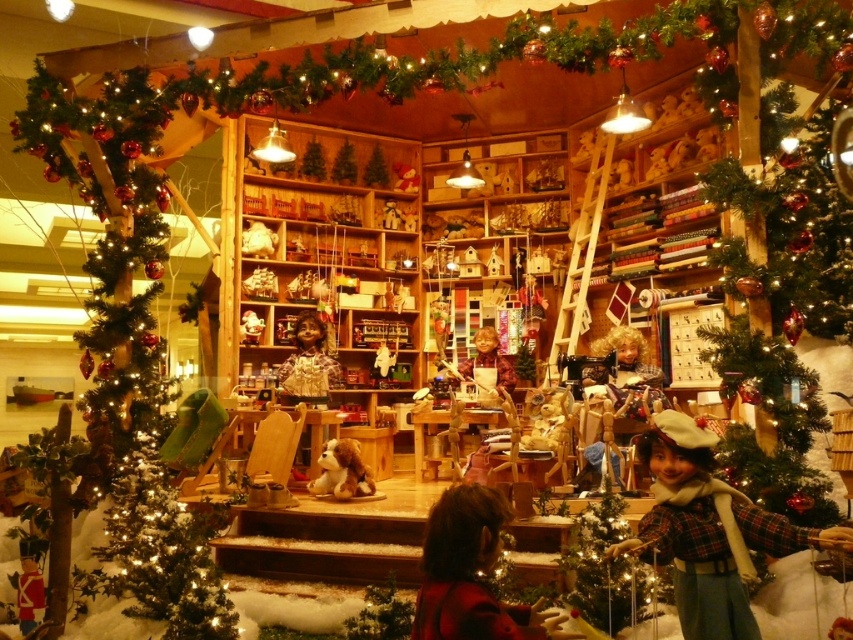
Question: Can you confirm if brown woolen sweater at lower center is smaller than smooth wooden doll at center?

Choices:
 (A) no
 (B) yes

Answer: (A)

Question: Among these points, which one is nearest to the camera?

Choices:
 (A) (83, 150)
 (B) (459, 372)
 (C) (331, 488)

Answer: (A)

Question: Which is nearer to the wooden doll at center?

Choices:
 (A) smooth wooden doll at center
 (B) brown woolen sweater at lower center
 (C) green textured christmas tree at left

Answer: (A)

Question: Does green textured christmas tree at left appear on the right side of smooth wooden doll at center?

Choices:
 (A) yes
 (B) no

Answer: (B)

Question: Can you confirm if green textured christmas tree at left is thinner than brown woolen sweater at lower center?

Choices:
 (A) yes
 (B) no

Answer: (B)

Question: Among these objects, which one is nearest to the camera?

Choices:
 (A) wooden doll at center
 (B) brown woolen sweater at lower center
 (C) smooth wooden doll at center
 (D) green textured christmas tree at left

Answer: (B)